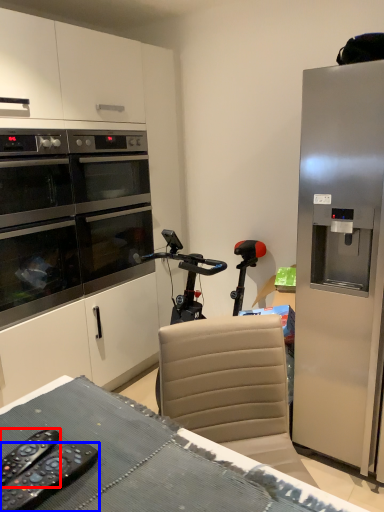
Question: Which object appears farthest to the camera in this image, remote control (highlighted by a red box) or remote control (highlighted by a blue box)?

Choices:
 (A) remote control
 (B) remote control

Answer: (A)